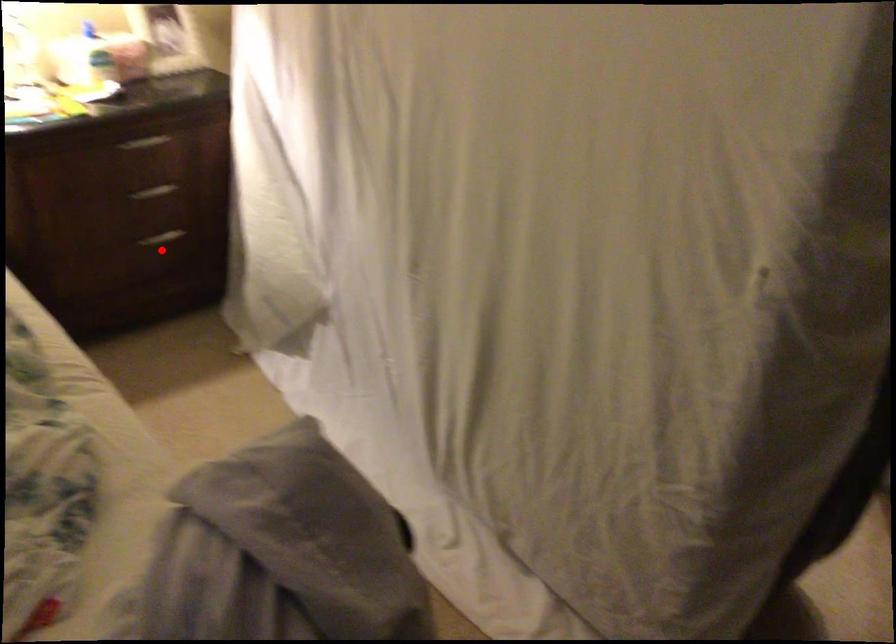
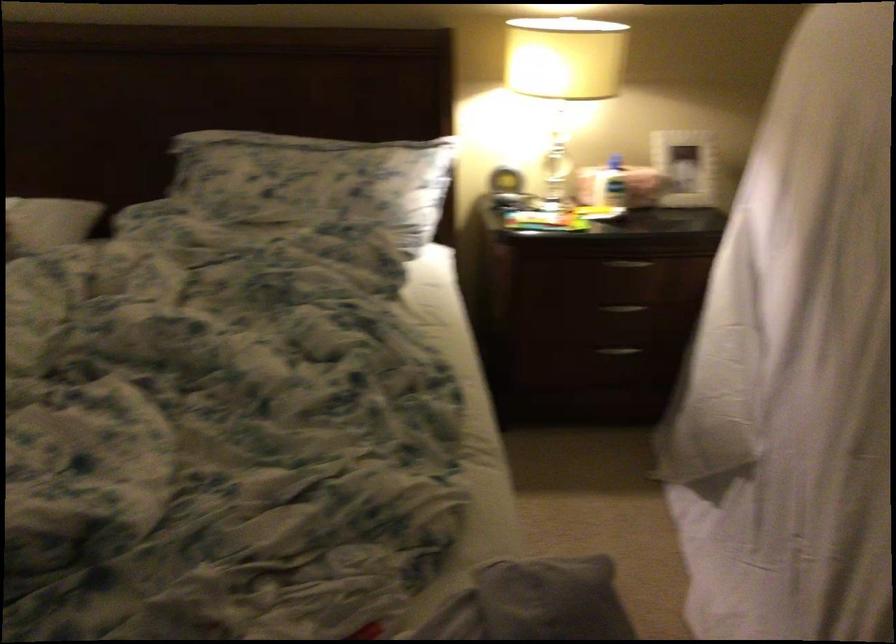
Locate, in the second image, the point that corresponds to the highlighted location in the first image.

(616, 355)